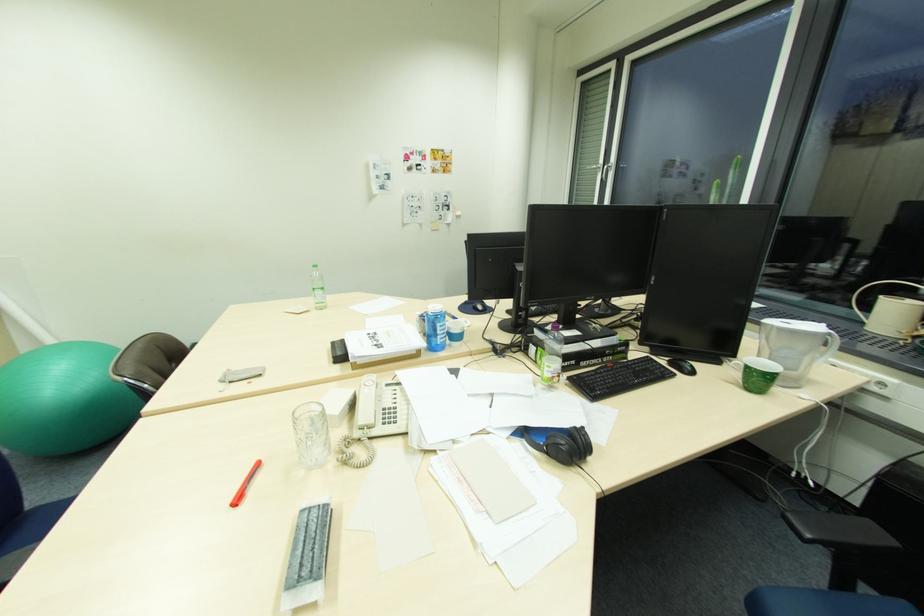
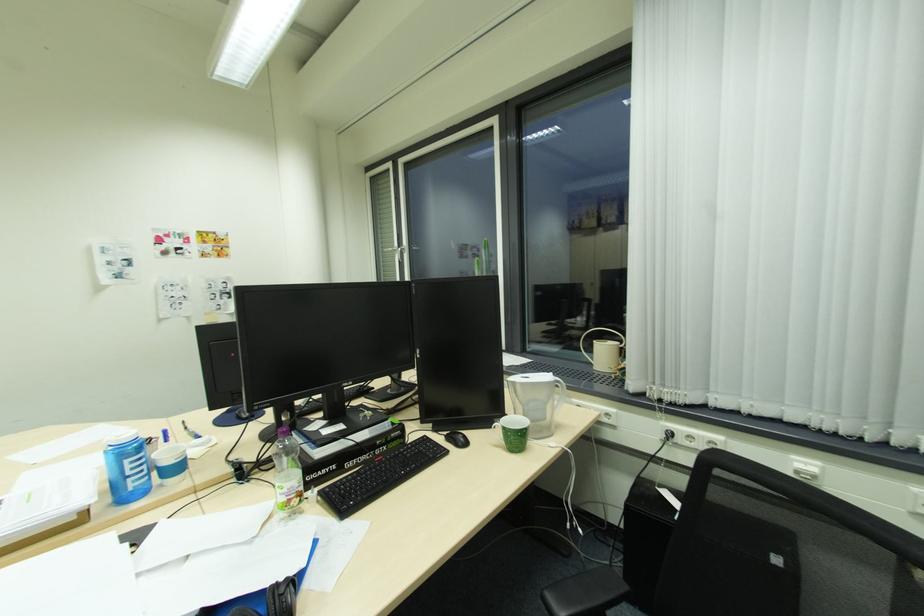
In the second image, find the point that corresponds to [603,168] in the first image.

(400, 251)